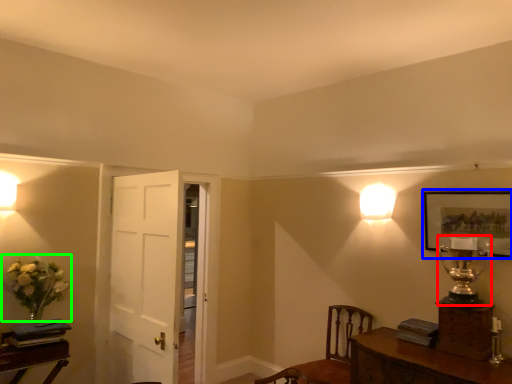
Question: Which object is the closest to the table lamp (highlighted by a red box)? Choose among these: picture frame (highlighted by a blue box) or floral arrangement (highlighted by a green box).

Choices:
 (A) picture frame
 (B) floral arrangement

Answer: (A)